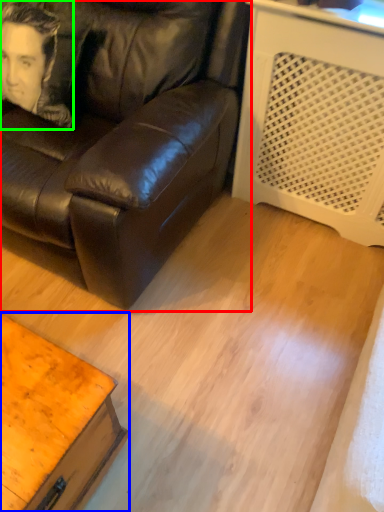
Question: Estimate the real-world distances between objects in this image. Which object is farther from studio couch (highlighted by a red box), table (highlighted by a blue box) or man (highlighted by a green box)?

Choices:
 (A) table
 (B) man

Answer: (A)